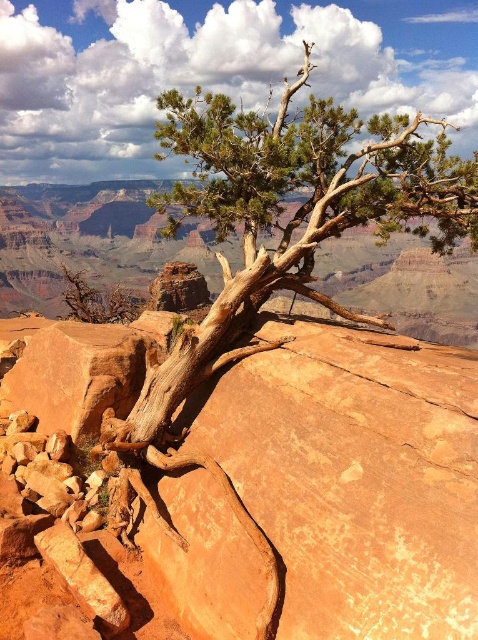
Question: Can you confirm if orange rough rock at center is positioned below brown rough bark tree at center?

Choices:
 (A) no
 (B) yes

Answer: (B)

Question: Observing the image, what is the correct spatial positioning of orange rough rock at center in reference to brown rough bark tree at center?

Choices:
 (A) above
 (B) below

Answer: (B)

Question: Can you confirm if orange rough rock at center is smaller than brown rough bark tree at center?

Choices:
 (A) yes
 (B) no

Answer: (A)

Question: Which object appears farthest from the camera in this image?

Choices:
 (A) brown rough bark tree at center
 (B) orange rough rock at center

Answer: (A)